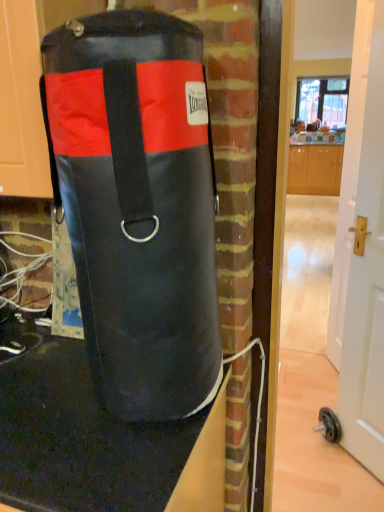
Question: From the image's perspective, is black rubber mat at lower left above transparent glass window at upper center?

Choices:
 (A) no
 (B) yes

Answer: (A)

Question: Could you tell me if black rubber mat at lower left is turned towards transparent glass window at upper center?

Choices:
 (A) no
 (B) yes

Answer: (A)

Question: Is black rubber mat at lower left closer to camera compared to transparent glass window at upper center?

Choices:
 (A) no
 (B) yes

Answer: (B)

Question: Is black rubber mat at lower left wider than transparent glass window at upper center?

Choices:
 (A) yes
 (B) no

Answer: (A)

Question: Is black rubber mat at lower left to the left of transparent glass window at upper center from the viewer's perspective?

Choices:
 (A) no
 (B) yes

Answer: (B)

Question: Is black rubber mat at lower left positioned behind transparent glass window at upper center?

Choices:
 (A) no
 (B) yes

Answer: (A)

Question: Is white glossy door at center right oriented away from transparent glass window at upper center?

Choices:
 (A) no
 (B) yes

Answer: (A)

Question: Does white glossy door at center right lie in front of transparent glass window at upper center?

Choices:
 (A) yes
 (B) no

Answer: (A)

Question: Is white glossy door at center right taller than transparent glass window at upper center?

Choices:
 (A) yes
 (B) no

Answer: (A)

Question: Is white glossy door at center right touching transparent glass window at upper center?

Choices:
 (A) no
 (B) yes

Answer: (A)

Question: Is transparent glass window at upper center inside white glossy door at center right?

Choices:
 (A) no
 (B) yes

Answer: (A)

Question: Is white glossy door at center right smaller than transparent glass window at upper center?

Choices:
 (A) no
 (B) yes

Answer: (B)

Question: From a real-world perspective, is black leather punching bag at center under transparent glass window at upper center?

Choices:
 (A) no
 (B) yes

Answer: (B)